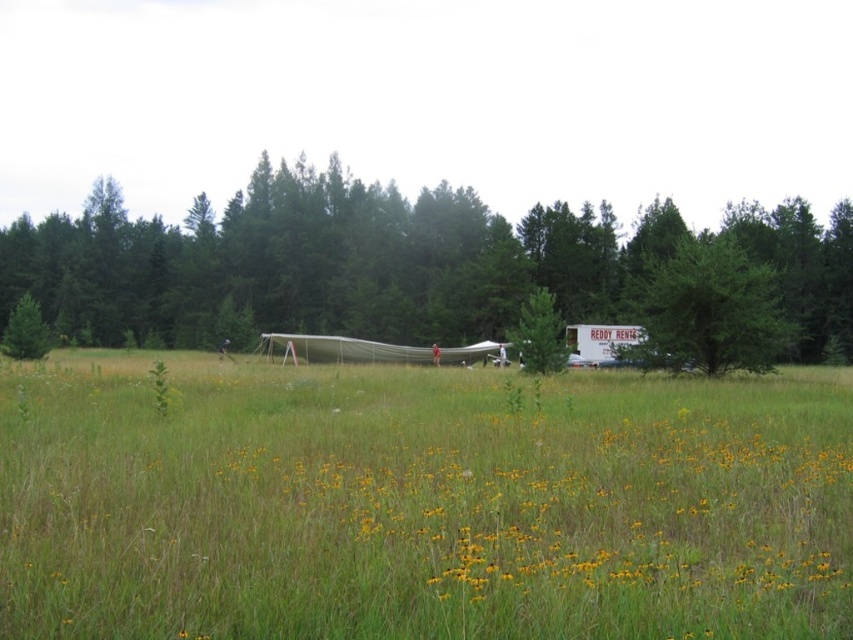
Question: Observing the image, what is the correct spatial positioning of green leafy tree at center-right in reference to green matte tree at left?

Choices:
 (A) below
 (B) above

Answer: (B)

Question: Can you confirm if yellow grass at center is wider than green matte tree at center?

Choices:
 (A) no
 (B) yes

Answer: (A)

Question: Is yellow grass at center closer to the viewer compared to green leafy tree at center-right?

Choices:
 (A) yes
 (B) no

Answer: (A)

Question: Among these objects, which one is farthest from the camera?

Choices:
 (A) green leafy tree at center-right
 (B) green matte tree at center
 (C) yellow grass at center
 (D) green leafy tree at center

Answer: (B)

Question: Which object appears farthest from the camera in this image?

Choices:
 (A) green leafy tree at center
 (B) green leafy tree at center-right
 (C) green matte tree at left
 (D) yellow grass at center

Answer: (C)

Question: Which object is the closest to the green matte tree at center?

Choices:
 (A) green leafy tree at center
 (B) yellow grass at center

Answer: (B)